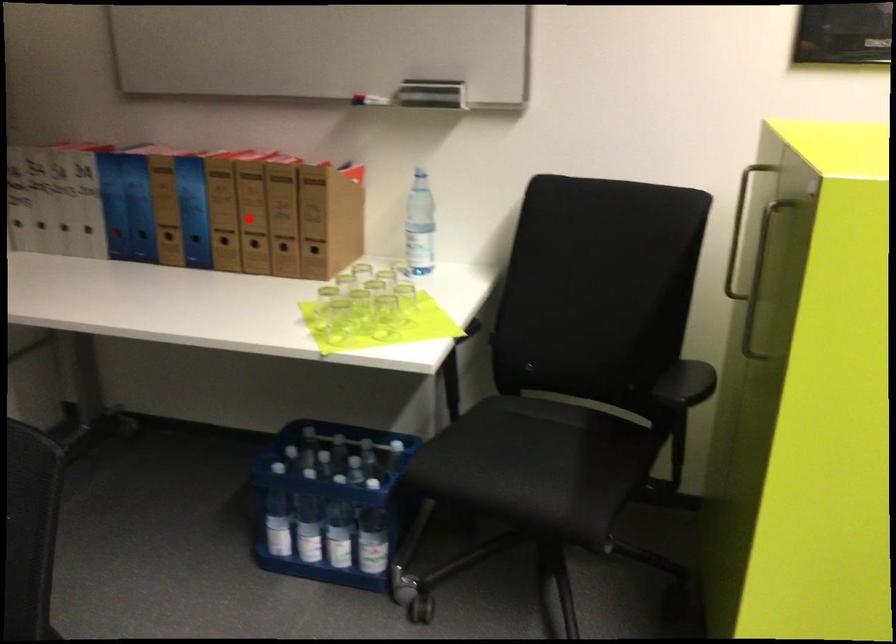
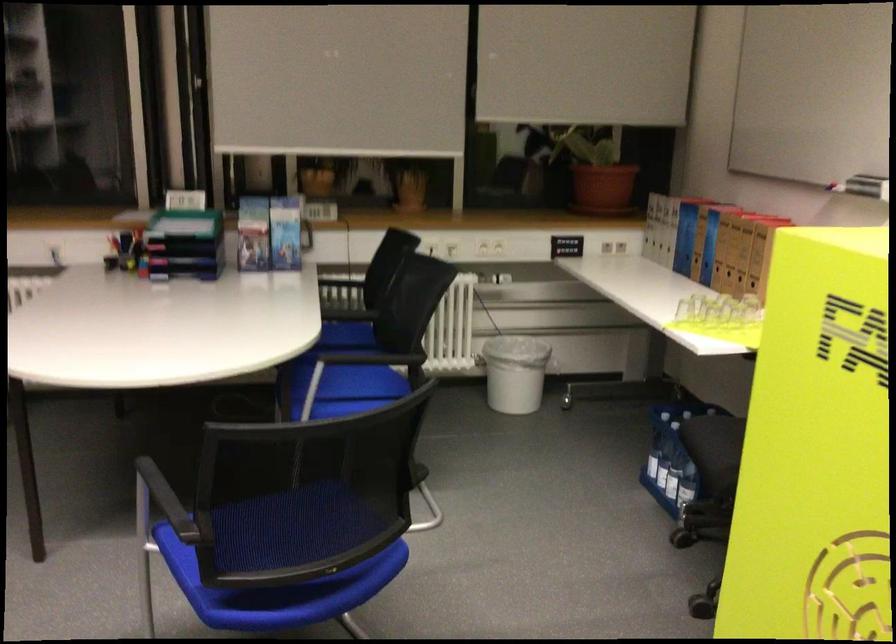
Question: I am providing you with two images of the same scene from different viewpoints. A red point is marked on the first image. At the location where the point appears in image 1, is it still visible in image 2?

Choices:
 (A) Yes
 (B) No

Answer: (A)